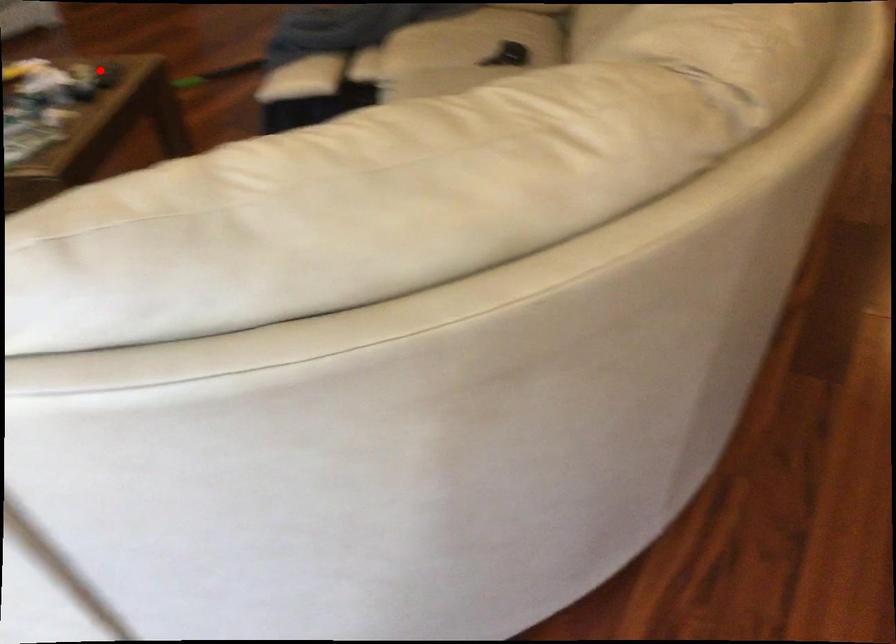
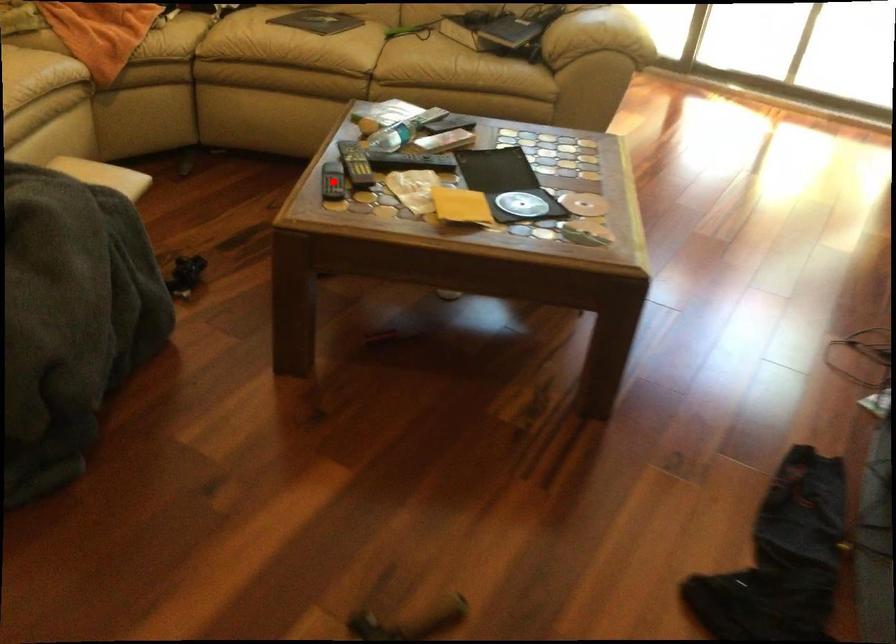
I am providing you with two images of the same scene from different viewpoints. A red point is marked on the first image and another point is marked on the second image. Does the point marked in image1 correspond to the same location as the one in image2?

Yes